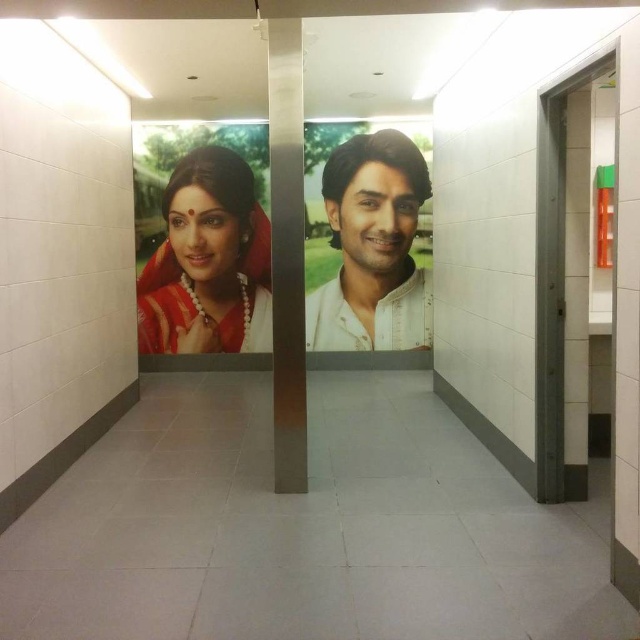
You are an interior designer planning to hang two items in a small office. You have a matte red saree at center and a white cotton shirt at center. Given their sizes, which item would you choose to hang if you want to fill the wall space more effectively?

The matte red saree at center has a larger width than the white cotton shirt at center, so it would be the better choice to fill the wall space more effectively.